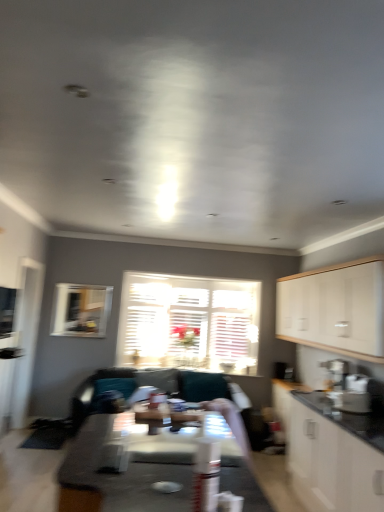
Question: Is white matte cabinet at right, which is the first cabinetry from top to bottom, positioned far away from wooden glossy table at center, placed as the first table when sorted from top to bottom?

Choices:
 (A) yes
 (B) no

Answer: (A)

Question: From the image's perspective, is white matte cabinet at right, which appears as the second cabinetry when ordered from the bottom, over wooden glossy table at center, acting as the 2th table starting from the bottom?

Choices:
 (A) no
 (B) yes

Answer: (B)

Question: Can you confirm if white matte cabinet at right, which appears as the second cabinetry when ordered from the bottom, is positioned to the right of wooden glossy table at center, placed as the first table when sorted from top to bottom?

Choices:
 (A) yes
 (B) no

Answer: (A)

Question: From the image's perspective, is white matte cabinet at right, which appears as the second cabinetry when ordered from the bottom, under wooden glossy table at center, placed as the first table when sorted from top to bottom?

Choices:
 (A) no
 (B) yes

Answer: (A)

Question: Can wooden glossy table at center, placed as the first table when sorted from top to bottom, be found inside white matte cabinet at right, which appears as the second cabinetry when ordered from the bottom?

Choices:
 (A) no
 (B) yes

Answer: (A)

Question: Is clear glass window screen at left inside the boundaries of clear glass window at upper left, acting as the 1th window starting from the left, or outside?

Choices:
 (A) outside
 (B) inside

Answer: (A)

Question: From a real-world perspective, relative to clear glass window at upper left, acting as the second window starting from the right, is clear glass window screen at left vertically above or below?

Choices:
 (A) below
 (B) above

Answer: (A)

Question: Does point (6, 288) appear closer or farther from the camera than point (91, 293)?

Choices:
 (A) closer
 (B) farther

Answer: (A)

Question: In terms of width, does clear glass window screen at left look wider or thinner when compared to clear glass window at upper left, the second window when ordered from back to front?

Choices:
 (A) thin
 (B) wide

Answer: (B)

Question: From the image's perspective, is teal fabric couch at center located above or below clear glass window at upper left, acting as the first window starting from the front?

Choices:
 (A) below
 (B) above

Answer: (A)

Question: Is teal fabric couch at center situated inside clear glass window at upper left, acting as the 1th window starting from the left, or outside?

Choices:
 (A) inside
 (B) outside

Answer: (B)

Question: Considering their positions, is teal fabric couch at center located in front of or behind clear glass window at upper left, acting as the second window starting from the right?

Choices:
 (A) behind
 (B) front

Answer: (B)

Question: Based on their positions, is teal fabric couch at center located to the left or right of clear glass window at upper left, the second window when ordered from back to front?

Choices:
 (A) left
 (B) right

Answer: (B)

Question: From the image's perspective, is white wooden blinds at center, the first window when ordered from back to front, located above or below smooth white table at center, which is counted as the second table, starting from the top?

Choices:
 (A) above
 (B) below

Answer: (A)

Question: Considering the positions of point (152, 333) and point (81, 472), is point (152, 333) closer or farther from the camera than point (81, 472)?

Choices:
 (A) farther
 (B) closer

Answer: (A)